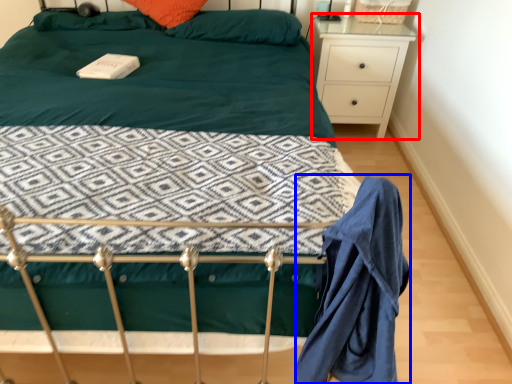
Question: Among these objects, which one is farthest to the camera, nightstand (highlighted by a red box) or robe (highlighted by a blue box)?

Choices:
 (A) nightstand
 (B) robe

Answer: (A)